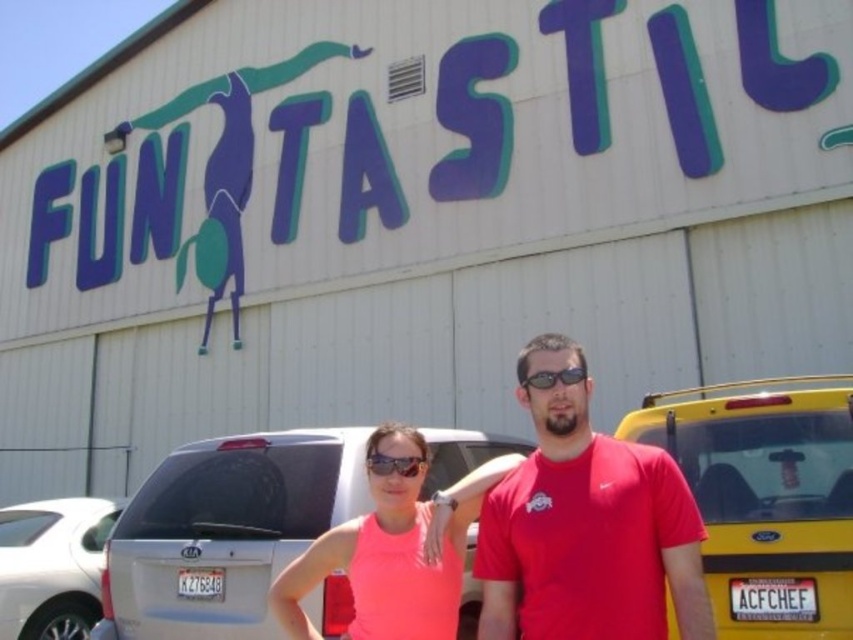
Question: Can you confirm if pink matte tank top at center is thinner than sunglasses at center?

Choices:
 (A) no
 (B) yes

Answer: (A)

Question: Which point is closer to the camera?

Choices:
 (A) (78, 540)
 (B) (575, 365)

Answer: (B)

Question: Does pink matte tank top at center appear on the left side of sunglasses at center?

Choices:
 (A) yes
 (B) no

Answer: (A)

Question: Which point is closer to the camera taking this photo?

Choices:
 (A) (57, 541)
 (B) (683, 564)

Answer: (B)

Question: Which object appears closest to the camera in this image?

Choices:
 (A) white glossy sedan at lower left
 (B) matte black goggles at center
 (C) sunglasses at center

Answer: (C)

Question: Observing the image, what is the correct spatial positioning of pink matte tank top at center in reference to white glossy sedan at lower left?

Choices:
 (A) above
 (B) below

Answer: (A)